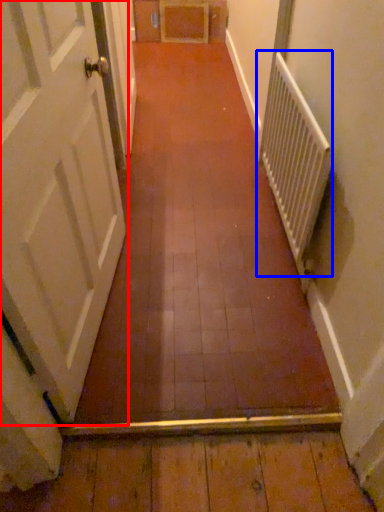
Question: Which of the following is the farthest to the observer, door (highlighted by a red box) or radiator (highlighted by a blue box)?

Choices:
 (A) door
 (B) radiator

Answer: (B)